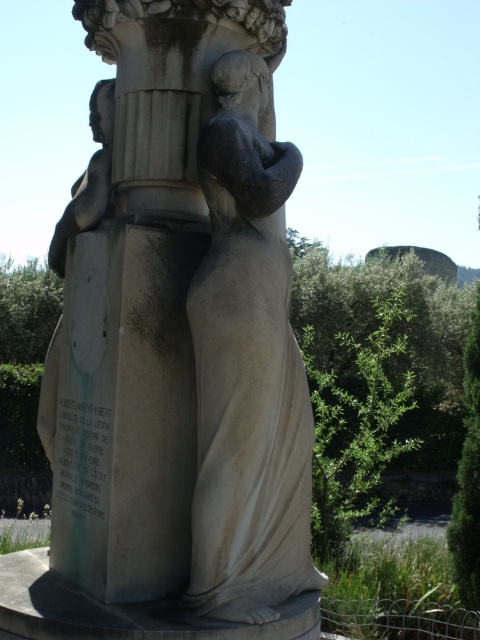
Question: From the image, what is the correct spatial relationship of matte stone statue at center in relation to matte stone bust at upper left?

Choices:
 (A) left
 (B) right

Answer: (B)

Question: Which object is the closest to the matte stone statue at center?

Choices:
 (A) matte stone bust at upper left
 (B) white marble statue at center

Answer: (B)

Question: Among these objects, which one is farthest from the camera?

Choices:
 (A) matte stone statue at center
 (B) matte stone bust at upper left
 (C) white marble statue at center

Answer: (B)

Question: Among these points, which one is nearest to the camera?

Choices:
 (A) (155, 227)
 (B) (239, 451)
 (C) (92, 186)

Answer: (B)

Question: Can you confirm if white marble statue at center is wider than matte stone statue at center?

Choices:
 (A) yes
 (B) no

Answer: (A)

Question: Is white marble statue at center thinner than matte stone bust at upper left?

Choices:
 (A) no
 (B) yes

Answer: (A)